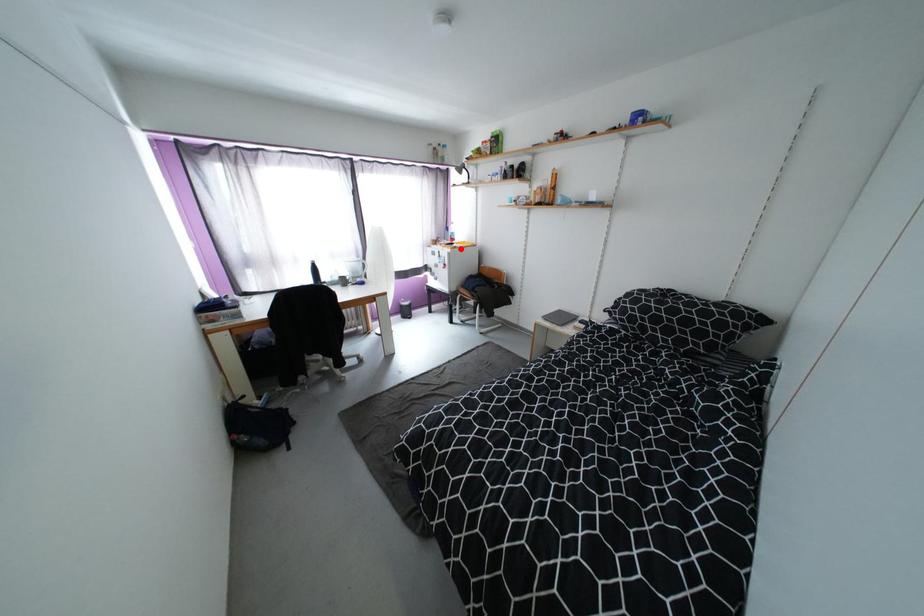
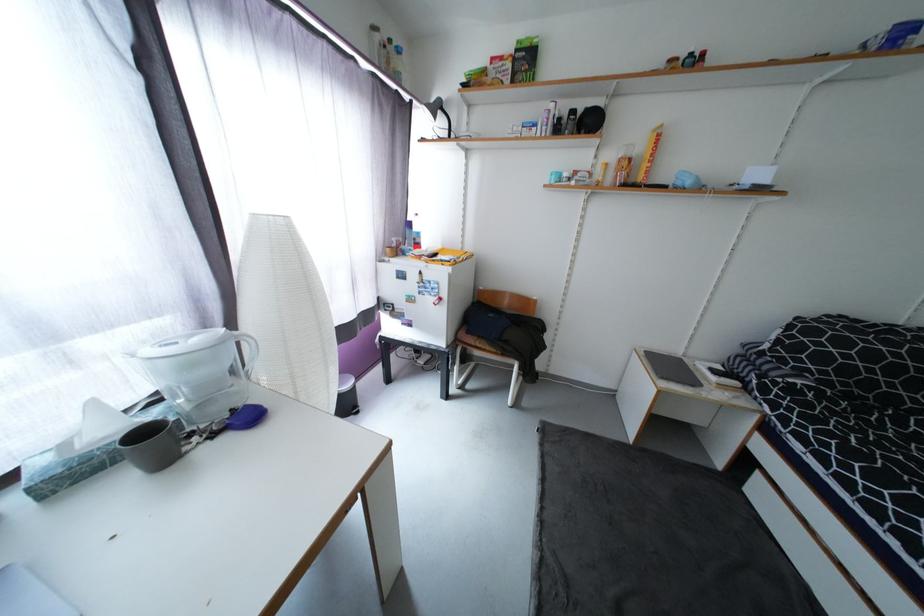
Question: I am providing you with two images of the same scene from different viewpoints. Image1 has a red point marked. In image2, the corresponding 3D location appears at what relative position? Reply with the corresponding letter.

Choices:
 (A) Closer
 (B) Farther

Answer: (B)